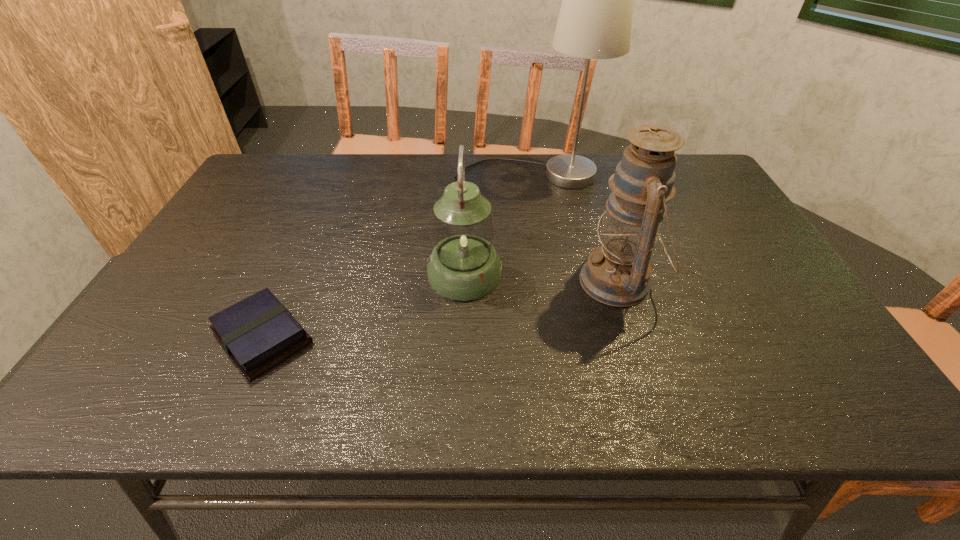
The height and width of the screenshot is (540, 960). I want to click on free area in between the shortest object and the second shortest object, so click(364, 306).

Locate an element on the screen. This screenshot has height=540, width=960. vacant area between the shortest object and the farthest object is located at coordinates (396, 256).

You are a GUI agent. You are given a task and a screenshot of the screen. Output one action in this format:
    pyautogui.click(x=<x>, y=<y>)
    Task: Click on the free space between the book and the oil lamp
    This screenshot has width=960, height=540.
    Given the screenshot: What is the action you would take?
    pyautogui.click(x=441, y=309)

What are the coordinates of `free space between the lantern and the oil lamp` in the screenshot? It's located at (541, 278).

This screenshot has width=960, height=540. In order to click on free space between the leftmost object and the second tallest object in this screenshot , I will do `click(441, 309)`.

Locate which object is the second closest to the oil lamp. Please provide its 2D coordinates. Your answer should be formatted as a tuple, i.e. [(x, y)], where the tuple contains the x and y coordinates of a point satisfying the conditions above.

[(595, 19)]

Identify the location of object that is the second closest to the second shortest object. (258, 333).

This screenshot has width=960, height=540. What are the coordinates of `blank area in the image that satisfies the following two spatial constraints: 1. on the back side of the tallest object; 2. on the left side of the shortest object` in the screenshot? It's located at (335, 176).

Where is `vacant region that satisfies the following two spatial constraints: 1. on the front side of the third shortest object; 2. on the right side of the third tallest object`? vacant region that satisfies the following two spatial constraints: 1. on the front side of the third shortest object; 2. on the right side of the third tallest object is located at coordinates (465, 282).